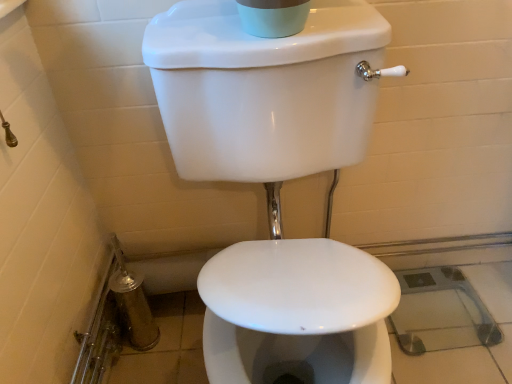
Question: Should I look upward or downward to see white glossy toilet at center?

Choices:
 (A) down
 (B) up

Answer: (A)